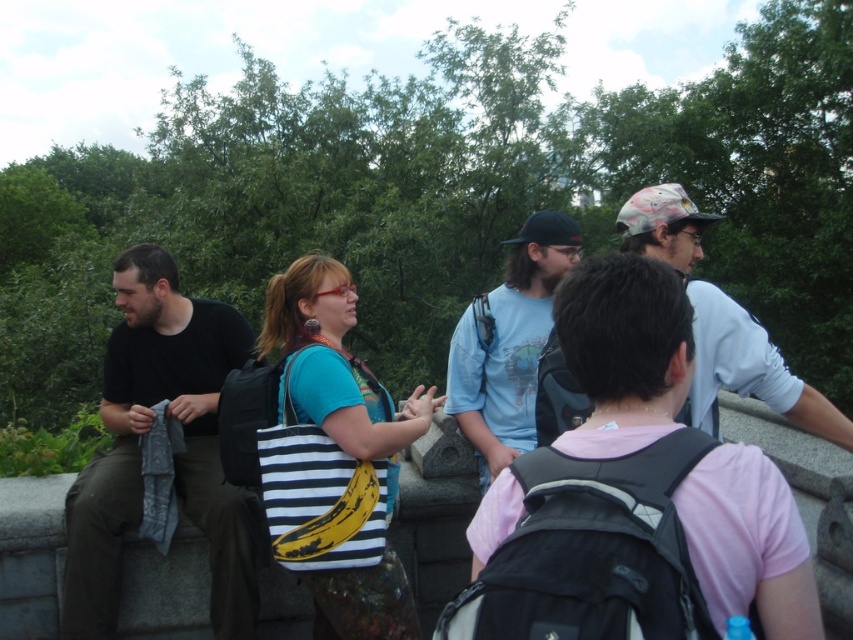
Consider the image. You are standing at the center of the park and see the group of people. There is a point marked at coordinates [173,456]. Which object from the following list is located exactly at that point? Choose between black matte shirt at left, turquoise top in center, yellow banana accessory on the right, striped bag on the left, and backpack at center.

The object located exactly at point [173,456] is the black matte shirt at left.